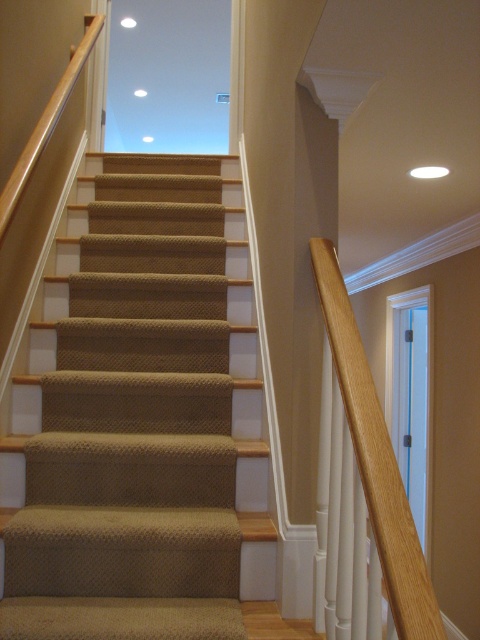
In the scene shown: You are a painter needing to reach the beige carpeted stairs at center and the wooden handrail at right to apply a fresh coat of paint. Which object is closer to the left side of the staircase?

The beige carpeted stairs at center is positioned on the left side of the wooden handrail at right, so the beige carpeted stairs at center is closer to the left side of the staircase.

You are a delivery person carrying a large box that is 2 feet wide. You need to navigate through the space between the beige carpeted stairs at center and the wooden handrail at right. Can your box fit through this space without touching either side?

The distance between the beige carpeted stairs at center and the wooden handrail at right is 27.16 inches. Since the box is 2 feet wide, which is 24 inches, there is a 3.16 inch gap remaining. Therefore, the box can fit through the space without touching either side.